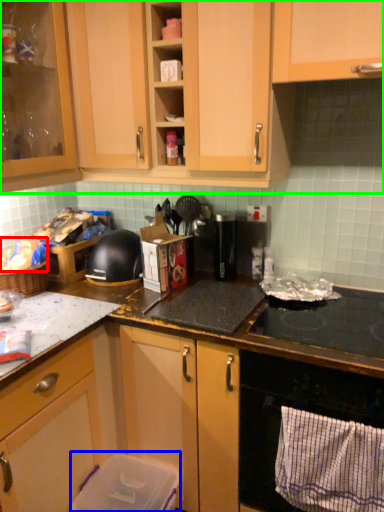
Question: Which object is the farthest from food (highlighted by a red box)? Choose among these: appliance (highlighted by a blue box) or cabinetry (highlighted by a green box).

Choices:
 (A) appliance
 (B) cabinetry

Answer: (A)